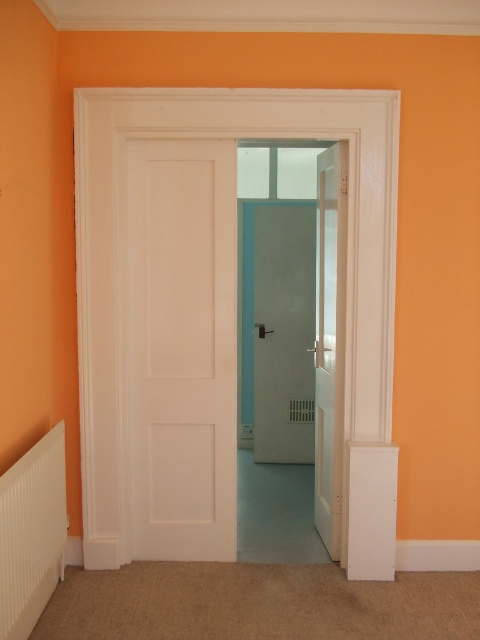
You are standing in the room with orange walls and want to exit through the door. Based on the coordinates provided, is the matte white door at center located closer to the top or bottom of the image?

The matte white door at center is located closer to the bottom of the image because its y coordinate is 0.592, which is closer to 1.0 than 0.0, indicating proximity to the bottom edge.

You are moving a rectangular box that is 1.2 meters wide. You need to pass through the doorway shown in the image. Based on the white glossy door at center and the white plastic radiator at lower left, can the box fit through the doorway?

The white glossy door at center is wider than the white plastic radiator at lower left. Since the door is wider, the 1.2 meter box may fit through the doorway if the door width is sufficient. However, without exact measurements, we can only confirm the door is wider than the radiator, not the box.

You are an interior designer planning to install a new door in the doorway. The existing door is the white matte door at center. You have a new door labeled matte white door at center. Which door takes up more space in the doorway?

The matte white door at center occupies more space than the white matte door at center, so the new door labeled matte white door at center takes up more space in the doorway.